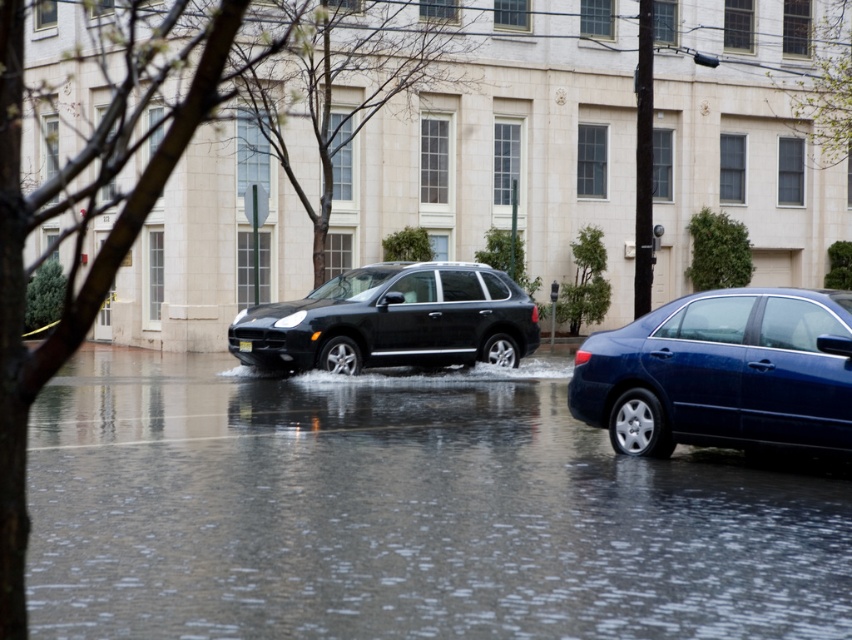
Question: Based on their relative distances, which object is farther from the glossy blue sedan at right?

Choices:
 (A) clear water at road center
 (B) matte black suv at center

Answer: (B)

Question: Is clear water at road center smaller than matte black suv at center?

Choices:
 (A) no
 (B) yes

Answer: (A)

Question: Which point appears closest to the camera in this image?

Choices:
 (A) (636, 470)
 (B) (724, 339)

Answer: (A)

Question: Can you confirm if glossy blue sedan at right is positioned to the left of matte black suv at center?

Choices:
 (A) no
 (B) yes

Answer: (A)

Question: Does clear water at road center appear on the left side of glossy blue sedan at right?

Choices:
 (A) no
 (B) yes

Answer: (B)

Question: Which point appears closest to the camera in this image?

Choices:
 (A) (373, 300)
 (B) (648, 336)

Answer: (B)